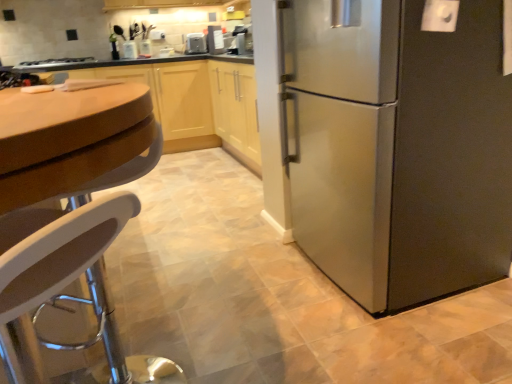
Identify the location of free space that is to the left of satin silver refrigerator at right. (238, 279).